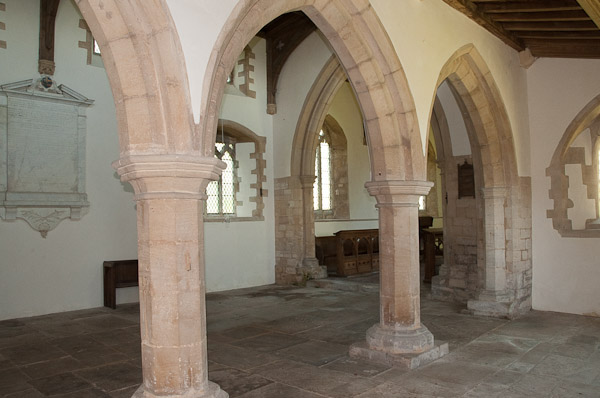
At what (x,y) coordinates should I click in order to perform the action: click on walls. Please return your answer as a coordinate pair (x, y). The height and width of the screenshot is (398, 600). Looking at the image, I should click on (547, 264), (350, 168), (248, 259).